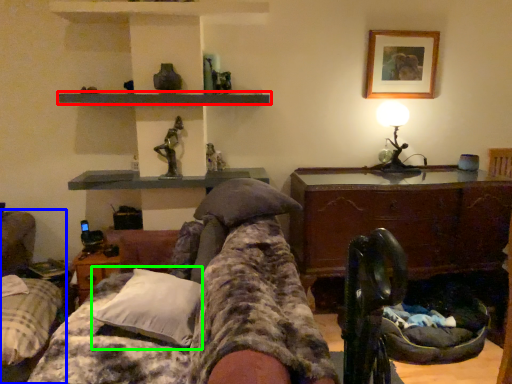
Question: Considering the real-world distances, which object is farthest from shelf (highlighted by a red box)? furniture (highlighted by a blue box) or pillow (highlighted by a green box)?

Choices:
 (A) furniture
 (B) pillow

Answer: (A)